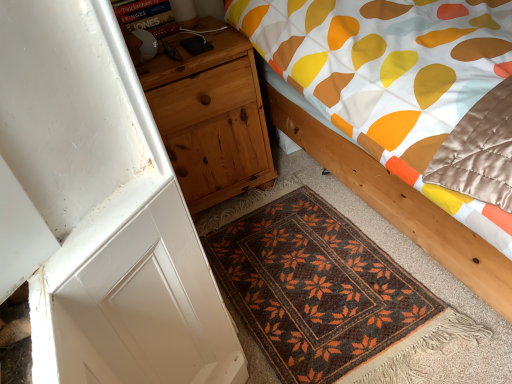
Question: Can you confirm if natural wood nightstand at left is shorter than wooden bed at center?

Choices:
 (A) no
 (B) yes

Answer: (B)

Question: Does natural wood nightstand at left have a greater height compared to wooden bed at center?

Choices:
 (A) no
 (B) yes

Answer: (A)

Question: Does natural wood nightstand at left touch wooden bed at center?

Choices:
 (A) yes
 (B) no

Answer: (B)

Question: Considering the relative sizes of natural wood nightstand at left and wooden bed at center in the image provided, is natural wood nightstand at left thinner than wooden bed at center?

Choices:
 (A) yes
 (B) no

Answer: (A)

Question: Is natural wood nightstand at left turned away from wooden bed at center?

Choices:
 (A) yes
 (B) no

Answer: (B)

Question: From a real-world perspective, is wooden bed at center positioned above or below natural wood nightstand at left?

Choices:
 (A) above
 (B) below

Answer: (A)

Question: Considering their positions, is wooden bed at center located in front of or behind natural wood nightstand at left?

Choices:
 (A) front
 (B) behind

Answer: (A)

Question: In terms of height, does wooden bed at center look taller or shorter compared to natural wood nightstand at left?

Choices:
 (A) tall
 (B) short

Answer: (A)

Question: Visually, is wooden bed at center positioned to the left or to the right of natural wood nightstand at left?

Choices:
 (A) left
 (B) right

Answer: (B)

Question: From the image's perspective, relative to brown woven mat at lower center, is natural wood nightstand at left above or below?

Choices:
 (A) below
 (B) above

Answer: (B)

Question: Is point (172, 145) closer or farther from the camera than point (330, 370)?

Choices:
 (A) closer
 (B) farther

Answer: (B)

Question: Do you think natural wood nightstand at left is within brown woven mat at lower center, or outside of it?

Choices:
 (A) outside
 (B) inside

Answer: (A)

Question: From a real-world perspective, is natural wood nightstand at left physically located above or below brown woven mat at lower center?

Choices:
 (A) below
 (B) above

Answer: (B)

Question: Looking at their shapes, would you say brown woven mat at lower center is wider or thinner than natural wood nightstand at left?

Choices:
 (A) wide
 (B) thin

Answer: (A)

Question: Considering their positions, is brown woven mat at lower center located in front of or behind natural wood nightstand at left?

Choices:
 (A) front
 (B) behind

Answer: (A)